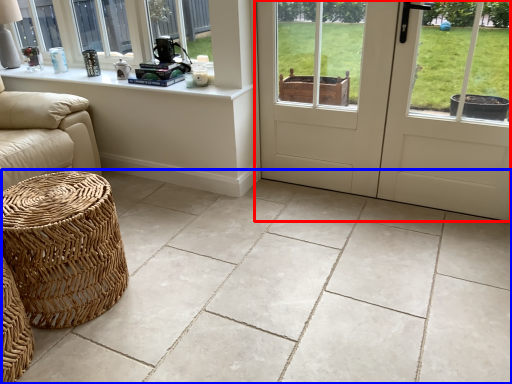
Question: Which object is further to the camera taking this photo, door (highlighted by a red box) or ceramic tile (highlighted by a blue box)?

Choices:
 (A) door
 (B) ceramic tile

Answer: (A)